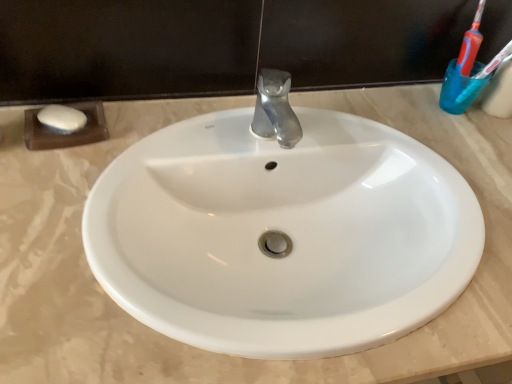
Question: Is white glossy sink at center taller or shorter than translucent plastic toothbrush at upper right?

Choices:
 (A) tall
 (B) short

Answer: (B)

Question: From a real-world perspective, is white glossy sink at center physically located above or below translucent plastic toothbrush at upper right?

Choices:
 (A) below
 (B) above

Answer: (A)

Question: Which object is positioned closest to the white glossy sink at center?

Choices:
 (A) translucent plastic toothbrush at upper right
 (B) transparent plastic cup at upper right

Answer: (B)

Question: Estimate the real-world distances between objects in this image. Which object is farther from the white glossy sink at center?

Choices:
 (A) translucent plastic toothbrush at upper right
 (B) transparent plastic cup at upper right

Answer: (A)